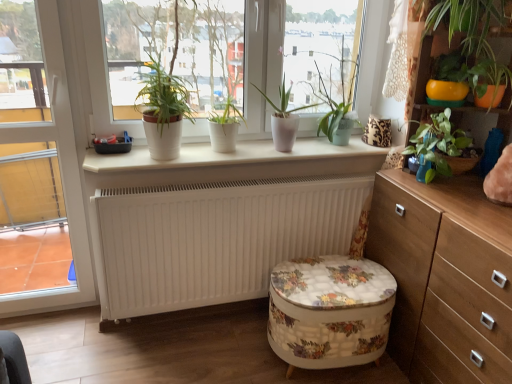
Question: Considering the positions of floral fabric ottoman at center and white matte pot at center, the 2th houseplant when ordered from left to right, in the image, is floral fabric ottoman at center bigger or smaller than white matte pot at center, the 2th houseplant when ordered from left to right,?

Choices:
 (A) big
 (B) small

Answer: (A)

Question: From the image's perspective, relative to white matte pot at center, the 2th houseplant when ordered from left to right, is floral fabric ottoman at center above or below?

Choices:
 (A) above
 (B) below

Answer: (B)

Question: Which is farther from the white matte pot at center, acting as the 4th houseplant starting from the right?

Choices:
 (A) pink ceramic plant pot at center, which is the 3th houseplant from right to left
 (B) white glossy door at left
 (C) white matte radiator at center
 (D) green glossy plant at upper right, the second houseplant positioned from the right
 (E) matte white pot at upper left, the fifth houseplant when ordered from right to left

Answer: (D)

Question: Which of these objects is positioned closest to the white matte window sill at center?

Choices:
 (A) white matte plant pots at center
 (B) white matte pot at center, acting as the 4th houseplant starting from the right
 (C) yellow plastic bowl at upper right
 (D) pink ceramic plant pot at center, which is the 3th houseplant from right to left
 (E) white matte radiator at center

Answer: (B)